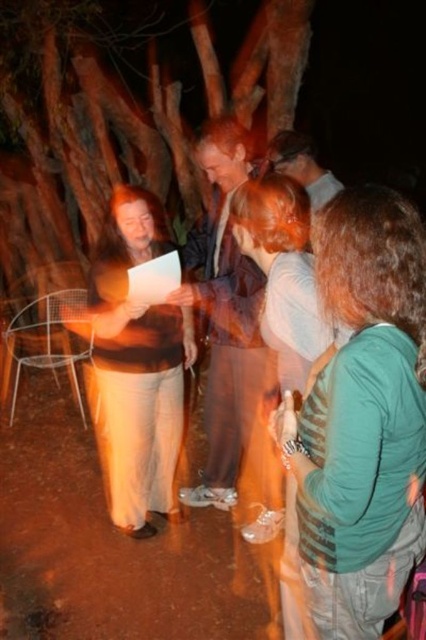
This screenshot has height=640, width=426. Describe the element at coordinates (118, 118) in the screenshot. I see `brown wood tree at upper center` at that location.

Can you confirm if brown wood tree at upper center is positioned to the right of brown matte shirt at center?

In fact, brown wood tree at upper center is to the left of brown matte shirt at center.

Does point (198, 195) come in front of point (170, 458)?

No, (198, 195) is behind (170, 458).

The height and width of the screenshot is (640, 426). I want to click on brown wood tree at upper center, so click(118, 118).

Is point (170, 461) more distant than point (238, 330)?

Yes, it is.

Describe the element at coordinates (138, 364) in the screenshot. I see `brown matte shirt at center` at that location.

This screenshot has width=426, height=640. What are the coordinates of `brown matte shirt at center` in the screenshot? It's located at (138, 364).

From the picture: Can you confirm if light brown leather jacket at center is smaller than matte brown shirt at upper center?

No.

What do you see at coordinates (224, 316) in the screenshot? I see `light brown leather jacket at center` at bounding box center [224, 316].

I want to click on light brown leather jacket at center, so click(224, 316).